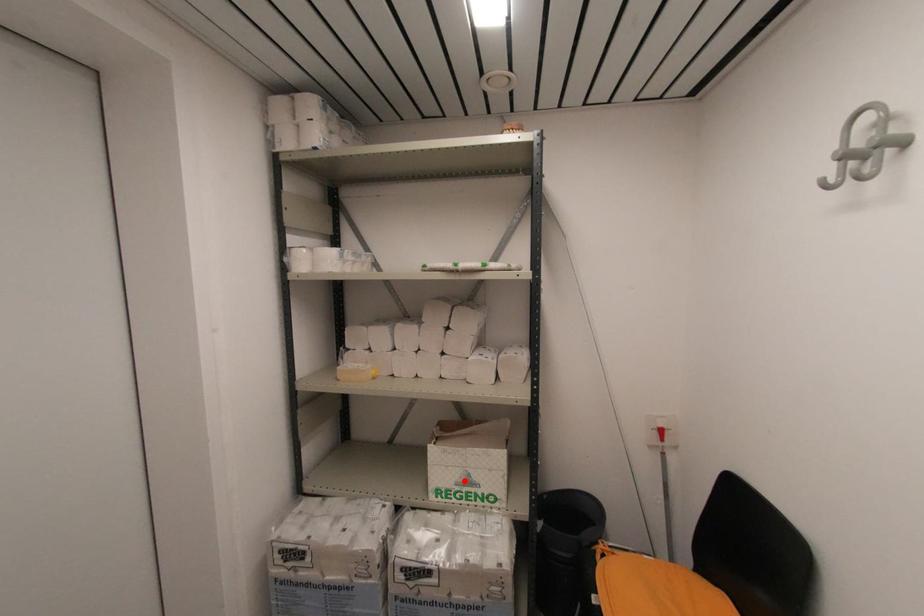
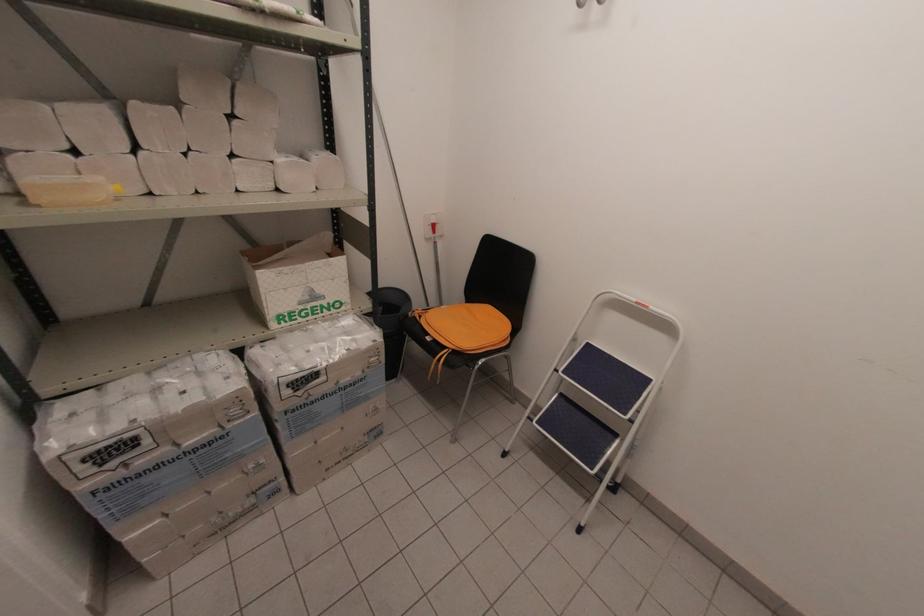
Question: I am providing you with two images of the same scene from different viewpoints. A red point is shown in image1. For the corresponding object point in image2, is it positioned nearer or farther from the camera?

Choices:
 (A) Nearer
 (B) Farther

Answer: (A)